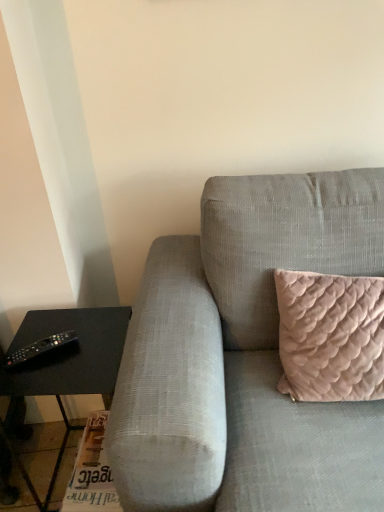
Question: Is black matte table at left bigger than black plastic remote at lower left?

Choices:
 (A) no
 (B) yes

Answer: (B)

Question: From a real-world perspective, is black matte table at left on black plastic remote at lower left?

Choices:
 (A) no
 (B) yes

Answer: (A)

Question: From the image's perspective, does black matte table at left appear lower than black plastic remote at lower left?

Choices:
 (A) no
 (B) yes

Answer: (B)

Question: Could you tell me if black matte table at left is facing black plastic remote at lower left?

Choices:
 (A) yes
 (B) no

Answer: (B)

Question: Does black matte table at left have a greater height compared to black plastic remote at lower left?

Choices:
 (A) no
 (B) yes

Answer: (B)

Question: Can you confirm if black matte table at left is wider than black plastic remote at lower left?

Choices:
 (A) no
 (B) yes

Answer: (B)

Question: Can you confirm if black matte table at left is shorter than textured gray couch at center?

Choices:
 (A) no
 (B) yes

Answer: (B)

Question: Is black matte table at left positioned behind textured gray couch at center?

Choices:
 (A) yes
 (B) no

Answer: (A)

Question: Is black matte table at left wider than textured gray couch at center?

Choices:
 (A) no
 (B) yes

Answer: (A)

Question: From the image's perspective, is black matte table at left under textured gray couch at center?

Choices:
 (A) yes
 (B) no

Answer: (A)

Question: Is the depth of black matte table at left less than that of textured gray couch at center?

Choices:
 (A) no
 (B) yes

Answer: (A)

Question: Is black matte table at left facing towards textured gray couch at center?

Choices:
 (A) no
 (B) yes

Answer: (A)

Question: Is textured gray couch at center positioned beyond the bounds of black plastic remote at lower left?

Choices:
 (A) yes
 (B) no

Answer: (A)